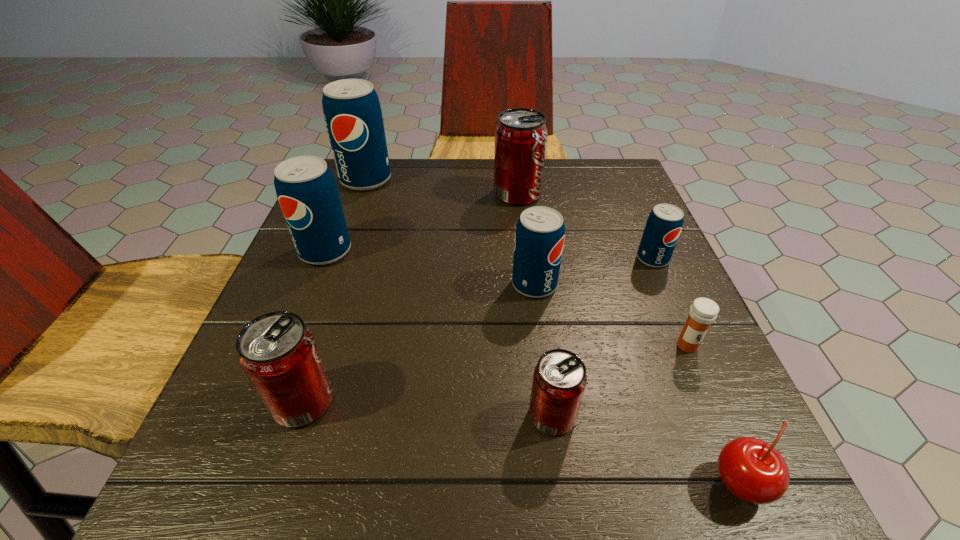
This screenshot has height=540, width=960. I want to click on vacant area situated 0.300m on the left of the cherry, so click(x=480, y=484).

Find the location of a particular element. Image resolution: width=960 pixels, height=540 pixels. object that is positioned at the near edge is located at coordinates (751, 469).

Find the location of a particular element. pop located in the right edge section of the desktop is located at coordinates (664, 224).

Find the location of a particular element. This screenshot has width=960, height=540. medicine that is at the right edge is located at coordinates (703, 312).

Find the location of `cherry at the right edge`. cherry at the right edge is located at coordinates (751, 469).

Where is `object present at the far left corner`? This screenshot has width=960, height=540. object present at the far left corner is located at coordinates (352, 112).

The width and height of the screenshot is (960, 540). What are the coordinates of `object located in the near right corner section of the desktop` in the screenshot? It's located at (751, 469).

You are a GUI agent. You are given a task and a screenshot of the screen. Output one action in this format:
    pyautogui.click(x=<x>, y=<y>)
    Task: Click on the free space at the far edge of the desktop
    The width and height of the screenshot is (960, 540).
    Given the screenshot: What is the action you would take?
    click(417, 210)

Locate an element on the screen. This screenshot has width=960, height=540. vacant space at the near edge of the desktop is located at coordinates (412, 481).

Identify the location of blank space at the left edge of the desktop. (350, 231).